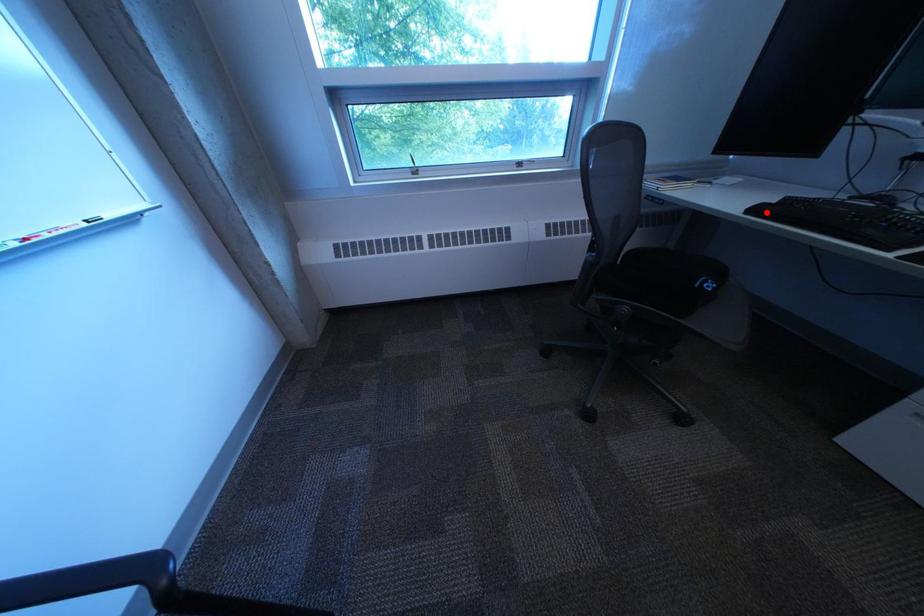
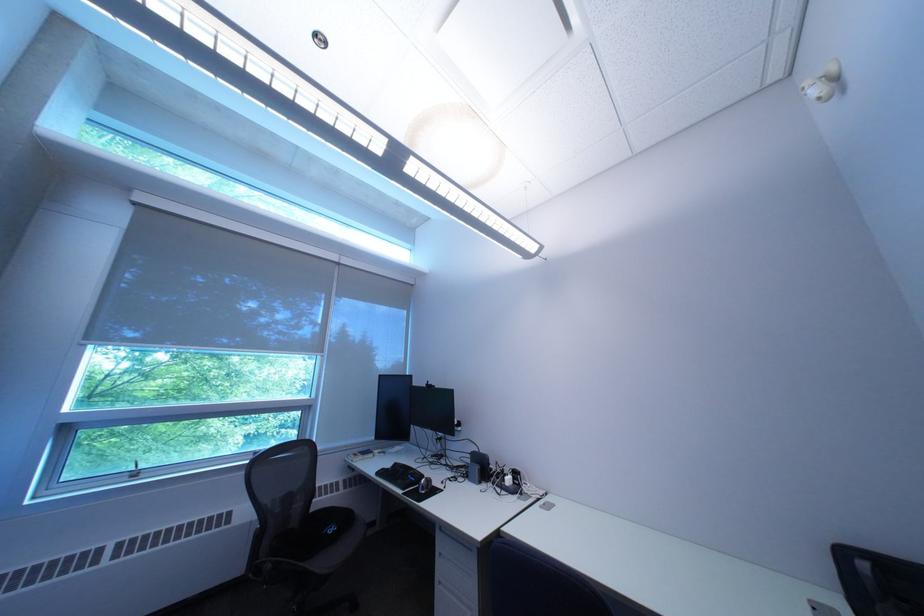
Question: I am providing you with two images of the same scene from different viewpoints. In image1, a red point is highlighted. Considering the same 3D point in image2, which of the following is correct?

Choices:
 (A) It is closer
 (B) It is farther

Answer: (A)